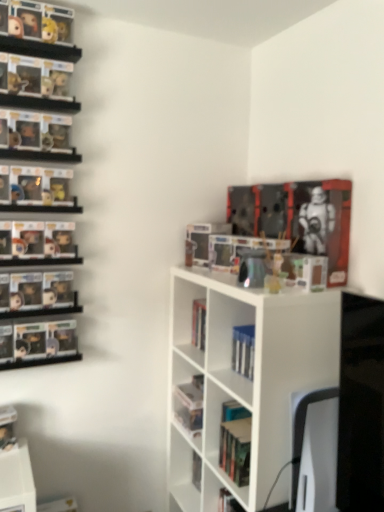
Question: Is metallic silver robot at upper right, the first book in the top-to-bottom sequence, oriented towards white matte bookshelf at center?

Choices:
 (A) no
 (B) yes

Answer: (A)

Question: Is metallic silver robot at upper right, placed as the second book when sorted from bottom to top, thinner than white matte bookshelf at center?

Choices:
 (A) no
 (B) yes

Answer: (B)

Question: Does metallic silver robot at upper right, placed as the second book when sorted from bottom to top, have a lesser height compared to white matte bookshelf at center?

Choices:
 (A) no
 (B) yes

Answer: (B)

Question: From a real-world perspective, is metallic silver robot at upper right, which is the 2th book in left-to-right order, positioned under white matte bookshelf at center based on gravity?

Choices:
 (A) no
 (B) yes

Answer: (A)

Question: From a real-world perspective, is metallic silver robot at upper right, which ranks as the first book in right-to-left order, on top of white matte bookshelf at center?

Choices:
 (A) no
 (B) yes

Answer: (B)

Question: Is metallic silver robot at upper right, the first book in the top-to-bottom sequence, positioned with its back to white matte bookshelf at center?

Choices:
 (A) no
 (B) yes

Answer: (A)

Question: Are white matte bookshelf at center and blue hardcover book at center, the 1th book ordered from the bottom, making contact?

Choices:
 (A) no
 (B) yes

Answer: (A)

Question: Is white matte bookshelf at center smaller than blue hardcover book at center, which is counted as the 2th book, starting from the right?

Choices:
 (A) no
 (B) yes

Answer: (A)

Question: From a real-world perspective, is white matte bookshelf at center on blue hardcover book at center, acting as the 1th book starting from the left?

Choices:
 (A) no
 (B) yes

Answer: (A)

Question: Does white matte bookshelf at center come behind blue hardcover book at center, which is counted as the 2th book, starting from the top?

Choices:
 (A) yes
 (B) no

Answer: (B)

Question: Can you confirm if white matte bookshelf at center is positioned to the left of blue hardcover book at center, which is counted as the 2th book, starting from the top?

Choices:
 (A) yes
 (B) no

Answer: (B)

Question: From a real-world perspective, is white matte bookshelf at center located beneath blue hardcover book at center, the 1th book ordered from the bottom?

Choices:
 (A) yes
 (B) no

Answer: (A)

Question: From the image's perspective, is blue hardcover book at center, which is counted as the 2th book, starting from the top, on white matte bookshelf at center?

Choices:
 (A) no
 (B) yes

Answer: (B)